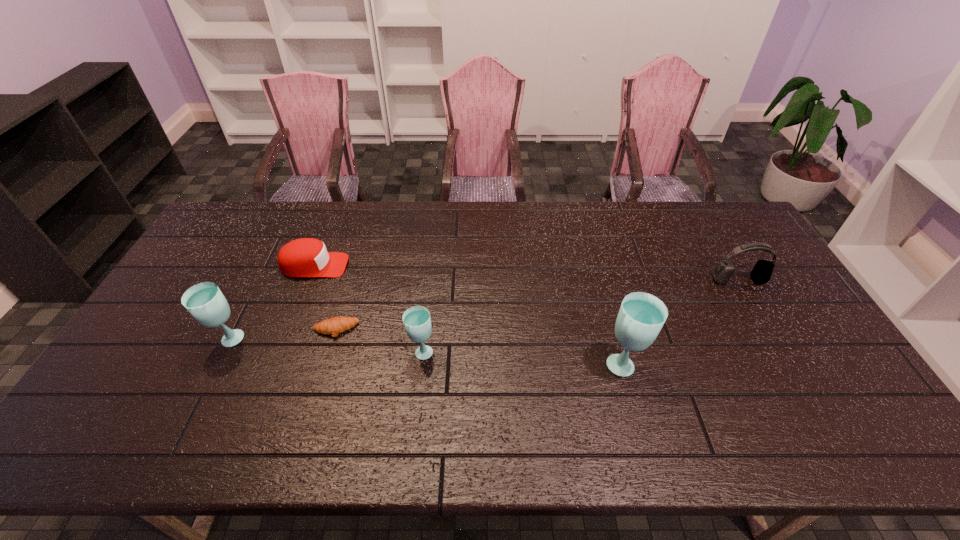
Choose which object is the nearest neighbor to the second glass from right to left. Please provide its 2D coordinates. Your answer should be formatted as a tuple, i.e. [(x, y)], where the tuple contains the x and y coordinates of a point satisfying the conditions above.

[(335, 325)]

Identify the location of the closest object relative to the headset. (641, 316).

Select which glass is the third closest to the rightmost object. Please provide its 2D coordinates. Your answer should be formatted as a tuple, i.e. [(x, y)], where the tuple contains the x and y coordinates of a point satisfying the conditions above.

[(205, 302)]

The height and width of the screenshot is (540, 960). Find the location of `glass that is the closest to the fifth shortest object`. glass that is the closest to the fifth shortest object is located at coordinates (416, 319).

This screenshot has height=540, width=960. What are the coordinates of `vacant space that satisfies the following two spatial constraints: 1. on the front side of the fourth object from left to right; 2. on the right side of the leftmost object` in the screenshot? It's located at (223, 351).

The image size is (960, 540). I want to click on vacant space that satisfies the following two spatial constraints: 1. on the front-facing side of the tallest object; 2. on the left side of the baseball cap, so click(x=276, y=363).

The image size is (960, 540). Identify the location of vacant region that satisfies the following two spatial constraints: 1. on the back side of the fourth object from left to right; 2. on the front-facing side of the second shortest object. (431, 266).

The image size is (960, 540). Find the location of `free location that satisfies the following two spatial constraints: 1. on the front-facing side of the tallest glass; 2. on the right side of the second shortest object`. free location that satisfies the following two spatial constraints: 1. on the front-facing side of the tallest glass; 2. on the right side of the second shortest object is located at coordinates (276, 363).